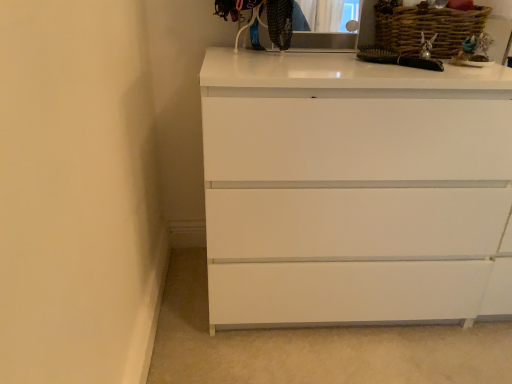
Question: Does woven brown basket at upper right have a lesser width compared to matte black medicine cabinet at upper center?

Choices:
 (A) no
 (B) yes

Answer: (A)

Question: Can you confirm if woven brown basket at upper right is bigger than matte black medicine cabinet at upper center?

Choices:
 (A) no
 (B) yes

Answer: (B)

Question: From a real-world perspective, is woven brown basket at upper right under matte black medicine cabinet at upper center?

Choices:
 (A) yes
 (B) no

Answer: (A)

Question: From the image's perspective, is woven brown basket at upper right located above matte black medicine cabinet at upper center?

Choices:
 (A) yes
 (B) no

Answer: (B)

Question: Does woven brown basket at upper right have a lesser height compared to matte black medicine cabinet at upper center?

Choices:
 (A) yes
 (B) no

Answer: (A)

Question: In terms of height, does matte black medicine cabinet at upper center look taller or shorter compared to white glossy chest of drawers at center?

Choices:
 (A) short
 (B) tall

Answer: (A)

Question: Is matte black medicine cabinet at upper center in front of or behind white glossy chest of drawers at center in the image?

Choices:
 (A) behind
 (B) front

Answer: (A)

Question: Looking at the image, does matte black medicine cabinet at upper center seem bigger or smaller compared to white glossy chest of drawers at center?

Choices:
 (A) big
 (B) small

Answer: (B)

Question: From the image's perspective, is matte black medicine cabinet at upper center above or below white glossy chest of drawers at center?

Choices:
 (A) above
 (B) below

Answer: (A)

Question: Is matte black medicine cabinet at upper center wider or thinner than woven brown basket at upper right?

Choices:
 (A) thin
 (B) wide

Answer: (A)

Question: From their relative heights in the image, would you say matte black medicine cabinet at upper center is taller or shorter than woven brown basket at upper right?

Choices:
 (A) tall
 (B) short

Answer: (A)

Question: Would you say matte black medicine cabinet at upper center is to the left or to the right of woven brown basket at upper right in the picture?

Choices:
 (A) right
 (B) left

Answer: (B)

Question: From the image's perspective, is matte black medicine cabinet at upper center located above or below woven brown basket at upper right?

Choices:
 (A) above
 (B) below

Answer: (A)

Question: In the image, is white glossy chest of drawers at center positioned in front of or behind woven brown basket at upper right?

Choices:
 (A) front
 (B) behind

Answer: (A)

Question: In the image, is white glossy chest of drawers at center on the left side or the right side of woven brown basket at upper right?

Choices:
 (A) right
 (B) left

Answer: (B)